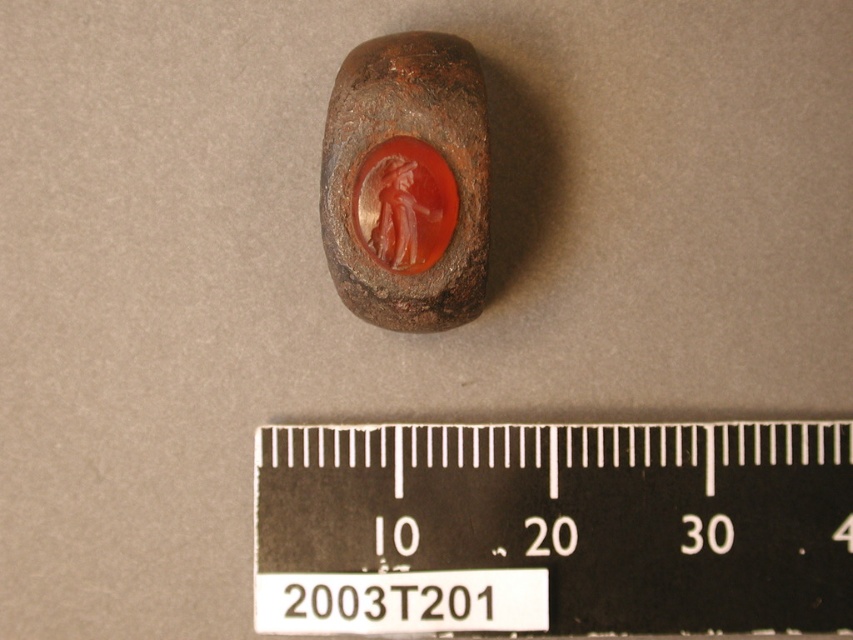
Does black plastic ruler at center have a greater height compared to matte brown stone at center?

No, black plastic ruler at center is not taller than matte brown stone at center.

Is point (740, 541) more distant than point (358, 132)?

Yes, it is.

This screenshot has height=640, width=853. I want to click on black plastic ruler at center, so click(x=553, y=529).

Is black plastic ruler at center positioned at the back of translucent orange gemstone at center?

Yes.

Between black plastic ruler at center and translucent orange gemstone at center, which one is positioned higher?

translucent orange gemstone at center is higher up.

Image resolution: width=853 pixels, height=640 pixels. What are the coordinates of `black plastic ruler at center` in the screenshot? It's located at (553, 529).

Does matte brown stone at center have a lesser height compared to translucent orange gemstone at center?

Incorrect, matte brown stone at center's height does not fall short of translucent orange gemstone at center's.

Is point (438, 51) less distant than point (384, 248)?

Yes, point (438, 51) is closer to viewer.

Locate an element on the screen. matte brown stone at center is located at coordinates (407, 182).